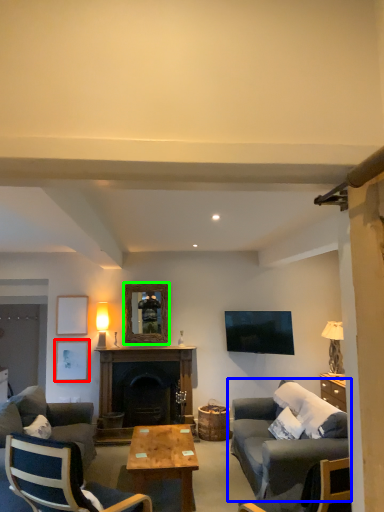
Question: Based on their relative distances, which object is farther from picture frame (highlighted by a red box)? Choose from studio couch (highlighted by a blue box) and picture frame (highlighted by a green box).

Choices:
 (A) studio couch
 (B) picture frame

Answer: (A)